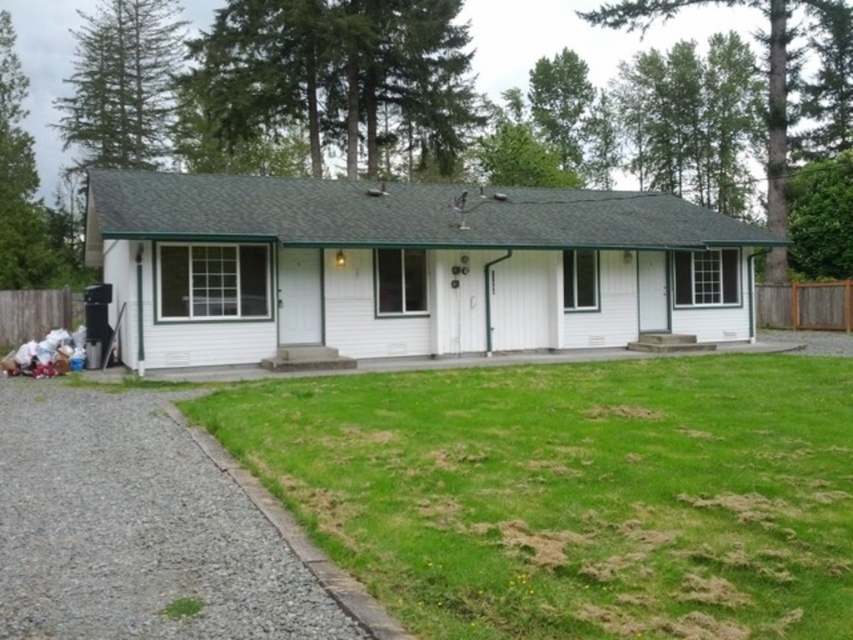
Question: Does white wood cottage at center appear under gray gravel driveway at lower left?

Choices:
 (A) no
 (B) yes

Answer: (A)

Question: Which is farther from the gray gravel driveway at lower left?

Choices:
 (A) white wood cottage at center
 (B) green grass at lower center

Answer: (A)

Question: Which of the following is the farthest from the observer?

Choices:
 (A) (740, 602)
 (B) (233, 484)

Answer: (B)

Question: Among these points, which one is farthest from the camera?

Choices:
 (A) (158, 470)
 (B) (339, 340)
 (C) (404, 582)

Answer: (B)

Question: Does green grass at lower center have a smaller size compared to white wood cottage at center?

Choices:
 (A) yes
 (B) no

Answer: (A)

Question: Is green grass at lower center bigger than gray gravel driveway at lower left?

Choices:
 (A) no
 (B) yes

Answer: (B)